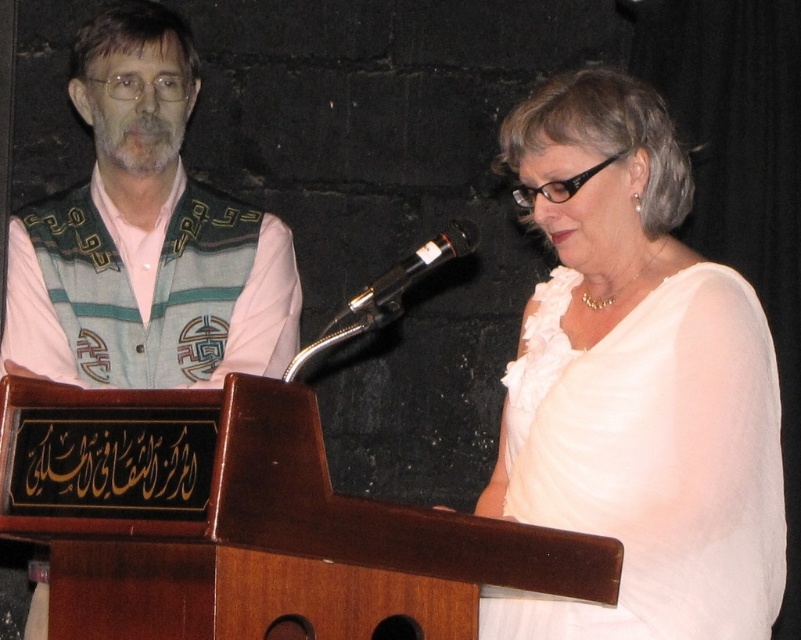
Question: Can you confirm if white satin blouse at center is positioned above black metallic microphone at center?

Choices:
 (A) yes
 (B) no

Answer: (B)

Question: Which of the following is the farthest from the observer?

Choices:
 (A) (147, 198)
 (B) (477, 230)

Answer: (A)

Question: Which object is positioned farthest from the white satin blouse at center?

Choices:
 (A) black metallic microphone at center
 (B) patterned fabric vest at left

Answer: (B)

Question: Can you confirm if white satin blouse at center is positioned to the left of black metallic microphone at center?

Choices:
 (A) no
 (B) yes

Answer: (A)

Question: Is patterned fabric vest at left to the right of black metallic microphone at center from the viewer's perspective?

Choices:
 (A) no
 (B) yes

Answer: (A)

Question: Which point is closer to the camera taking this photo?

Choices:
 (A) (155, 124)
 (B) (634, 513)
 (C) (351, 314)

Answer: (C)